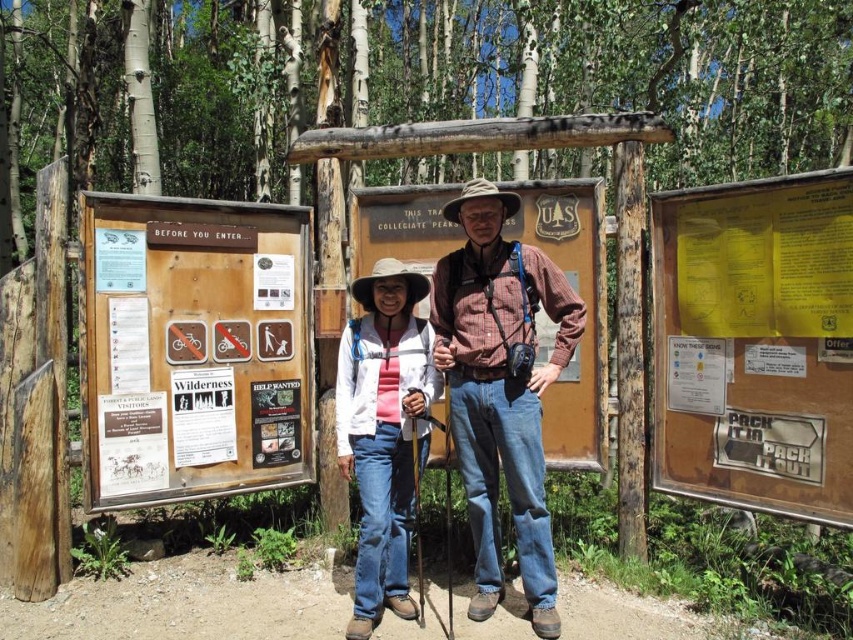
Question: Is white fabric cowboy hat at center smaller than brown woven cowboy hat at center?

Choices:
 (A) yes
 (B) no

Answer: (A)

Question: Which of the following is the closest to the observer?

Choices:
 (A) wooden sign at left
 (B) brown woven cowboy hat at center
 (C) white paper wilderness sign at center
 (D) matte paper sign at center

Answer: (B)

Question: Does matte paper sign at center have a lesser width compared to brown woven cowboy hat at center?

Choices:
 (A) yes
 (B) no

Answer: (A)

Question: Is white matte jacket at center bigger than white paper wilderness sign at center?

Choices:
 (A) no
 (B) yes

Answer: (B)

Question: Which point is farther from the camera taking this photo?

Choices:
 (A) (393, 525)
 (B) (606, 451)
 (C) (260, 292)
 (D) (387, 266)

Answer: (C)

Question: Which object is positioned closest to the yellow paper sign at center right?

Choices:
 (A) white paper wilderness sign at center
 (B) matte paper sign at center

Answer: (B)